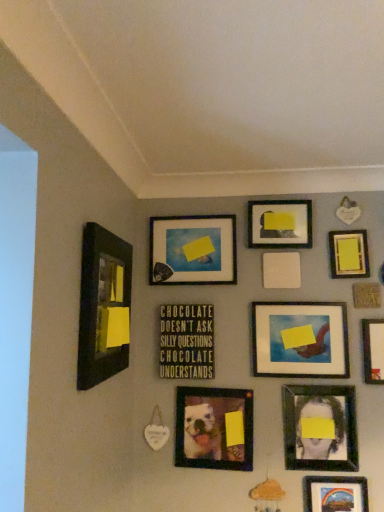
Question: Considering the positions of matte black frame at upper center, arranged as the second picture frame when viewed from the back, and yellow matte picture frame at upper right, which ranks as the fifth picture frame in back-to-front order, in the image, is matte black frame at upper center, arranged as the second picture frame when viewed from the back, wider or thinner than yellow matte picture frame at upper right, which ranks as the fifth picture frame in back-to-front order,?

Choices:
 (A) wide
 (B) thin

Answer: (A)

Question: Relative to yellow matte picture frame at upper right, which ranks as the fifth picture frame in back-to-front order, is matte black frame at upper center, the tenth picture frame from the front, in front or behind?

Choices:
 (A) front
 (B) behind

Answer: (B)

Question: Which object is the closest to the matte black portrait at lower right, which is the fourth picture frame in front-to-back order?

Choices:
 (A) metallic rainbow landscape at bottom right, arranged as the second picture frame when viewed from the front
 (B) green matte signboard at center, which is the 4th picture frame from back to front
 (C) matte plastic picture frame at center right, the 7th picture frame in the back-to-front sequence
 (D) white matte picture frame at upper right, which is counted as the 9th picture frame, starting from the back
 (E) yellow matte picture frame at upper right, which ranks as the fifth picture frame in back-to-front order

Answer: (A)

Question: Considering the real-world distances, which object is closest to the matte black picture frame at left, the first picture frame viewed from the front?

Choices:
 (A) matte black frame at center, which is counted as the first picture frame, starting from the back
 (B) white matte picture frame at upper right, which is counted as the 9th picture frame, starting from the back
 (C) matte plastic dog portrait at center, the 6th picture frame from the back
 (D) yellow matte picture frame at upper right, positioned as the seventh picture frame in front-to-back order
 (E) matte black frame at upper center, arranged as the second picture frame when viewed from the back

Answer: (A)